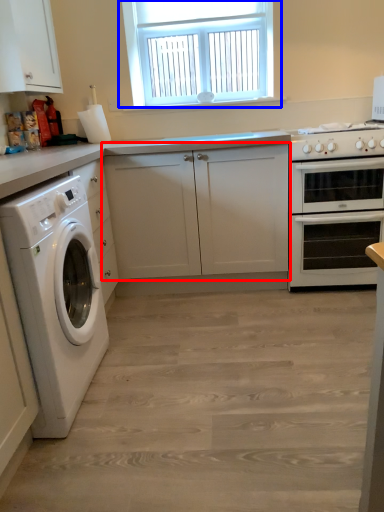
Question: Which of the following is the closest to the observer, cabinetry (highlighted by a red box) or window (highlighted by a blue box)?

Choices:
 (A) cabinetry
 (B) window

Answer: (A)